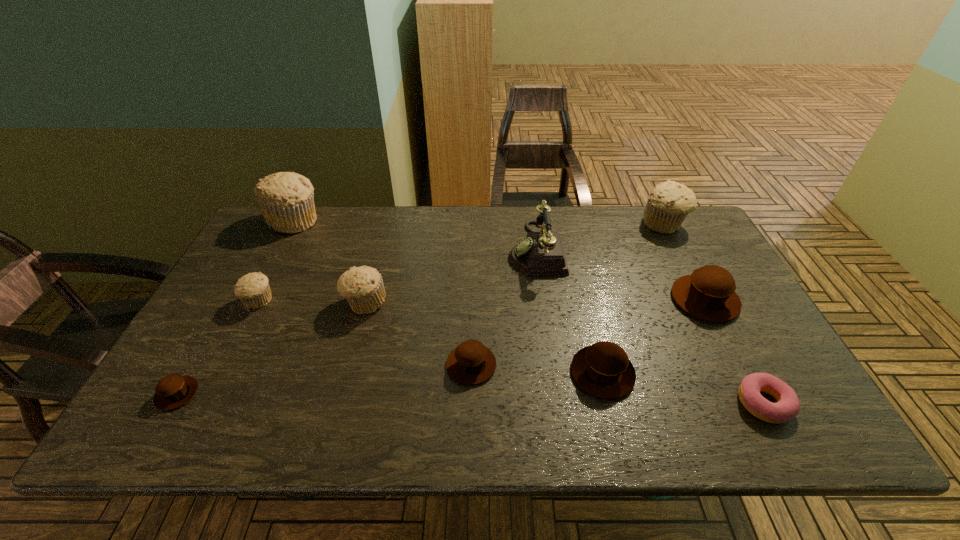
Find the location of a particular element. This screenshot has height=540, width=960. unoccupied position between the leftmost brown muffin and the biggest beige muffin is located at coordinates (235, 307).

The height and width of the screenshot is (540, 960). I want to click on object that ranks as the fifth closest to the fifth object from left to right, so click(x=708, y=293).

Where is `object that is the fourth closest to the tallest muffin`? Image resolution: width=960 pixels, height=540 pixels. object that is the fourth closest to the tallest muffin is located at coordinates (542, 253).

At what (x,y) coordinates should I click in order to perform the action: click on muffin identified as the sixth closest to the farthest brown muffin. Please return your answer as a coordinate pair (x, y). The image size is (960, 540). Looking at the image, I should click on (253, 289).

At what (x,y) coordinates should I click in order to perform the action: click on muffin that is the fifth closest to the seventh shortest muffin. Please return your answer as a coordinate pair (x, y). Looking at the image, I should click on (286, 199).

Locate which beige muffin ranks fourth in proximity to the second smallest brown muffin. Please provide its 2D coordinates. Your answer should be formatted as a tuple, i.e. [(x, y)], where the tuple contains the x and y coordinates of a point satisfying the conditions above.

[(668, 204)]

Locate an element on the screen. The height and width of the screenshot is (540, 960). beige muffin that can be found as the third closest to the tallest muffin is located at coordinates (668, 204).

Choose which brown muffin is the nearest neighbor to the smallest beige muffin. Please provide its 2D coordinates. Your answer should be formatted as a tuple, i.e. [(x, y)], where the tuple contains the x and y coordinates of a point satisfying the conditions above.

[(173, 391)]

Where is `brown muffin that is the third closest to the third muffin from right to left`? This screenshot has width=960, height=540. brown muffin that is the third closest to the third muffin from right to left is located at coordinates point(173,391).

You are a GUI agent. You are given a task and a screenshot of the screen. Output one action in this format:
    pyautogui.click(x=<x>, y=<y>)
    Task: Click on the vacant position in the image that satisfies the following two spatial constraints: 1. on the dial of the black telephone; 2. on the back side of the farthest brown muffin
    
    Given the screenshot: What is the action you would take?
    pyautogui.click(x=542, y=300)